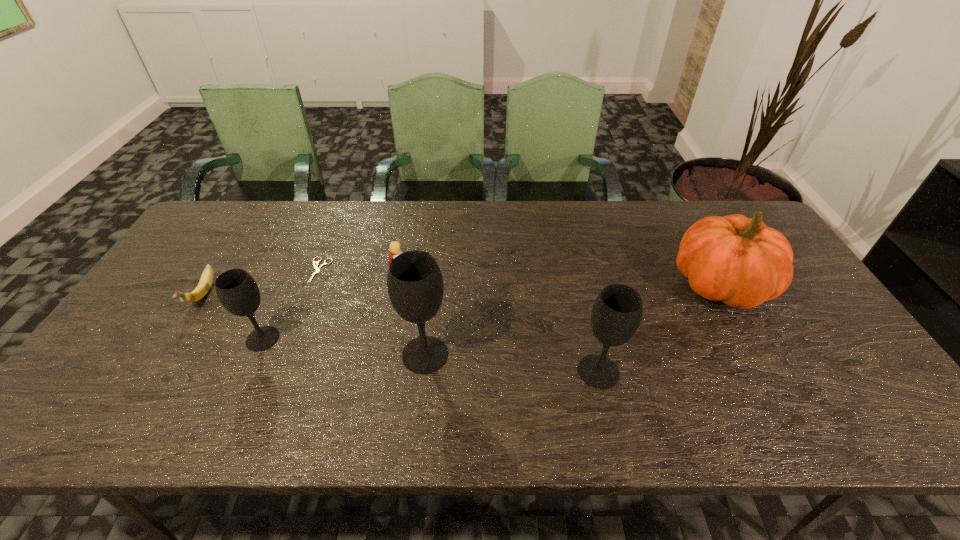
Locate an element on the screen. The height and width of the screenshot is (540, 960). the sixth object from right to left is located at coordinates (236, 289).

The image size is (960, 540). I want to click on the leftmost wineglass, so click(236, 289).

At what (x,y) coordinates should I click in order to perform the action: click on the second wineglass from left to right. Please return your answer as a coordinate pair (x, y). Looking at the image, I should click on (415, 286).

Identify the location of the second object from right to left. (616, 314).

Identify the location of the rightmost wineglass. (616, 314).

Image resolution: width=960 pixels, height=540 pixels. What are the coordinates of `the rightmost object` in the screenshot? It's located at (740, 261).

You are a GUI agent. You are given a task and a screenshot of the screen. Output one action in this format:
    pyautogui.click(x=<x>, y=<y>)
    Task: Click on the banana
    The image size is (960, 540).
    Given the screenshot: What is the action you would take?
    pyautogui.click(x=201, y=290)

The height and width of the screenshot is (540, 960). Identify the location of the sixth tallest object. (201, 290).

Image resolution: width=960 pixels, height=540 pixels. What are the coordinates of `shears` in the screenshot? It's located at (316, 268).

Find the location of a particular element. the fifth object from right to left is located at coordinates (316, 268).